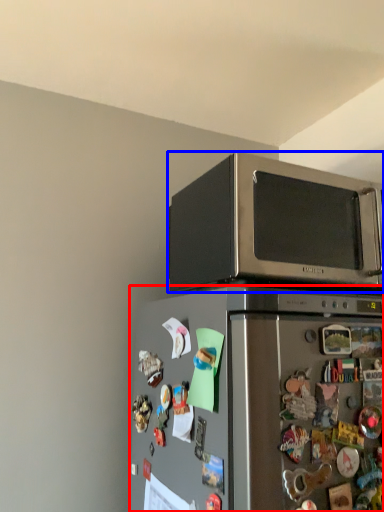
Question: Which point is further to the camera, refrigerator (highlighted by a red box) or microwave oven (highlighted by a blue box)?

Choices:
 (A) refrigerator
 (B) microwave oven

Answer: (B)